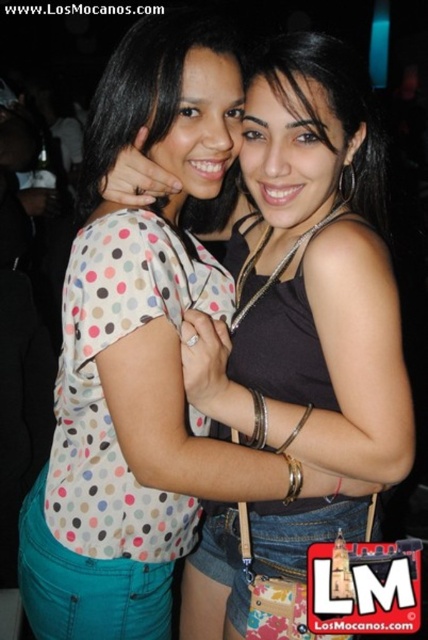
Question: Which of the following is the closest to the observer?

Choices:
 (A) polka dot shirt at center
 (B) matte black tank top at center

Answer: (B)

Question: Which point is farther to the camera?

Choices:
 (A) (145, 88)
 (B) (216, 401)
 (C) (23, 506)

Answer: (C)

Question: Does matte black tank top at center appear over polka dot fabric shirt at center?

Choices:
 (A) yes
 (B) no

Answer: (B)

Question: Does matte black tank top at center appear on the right side of polka dot shirt at center?

Choices:
 (A) no
 (B) yes

Answer: (B)

Question: Can you confirm if matte black tank top at center is smaller than polka dot fabric shirt at center?

Choices:
 (A) yes
 (B) no

Answer: (B)

Question: Which point is closer to the camera?

Choices:
 (A) polka dot shirt at center
 (B) matte black tank top at center

Answer: (B)